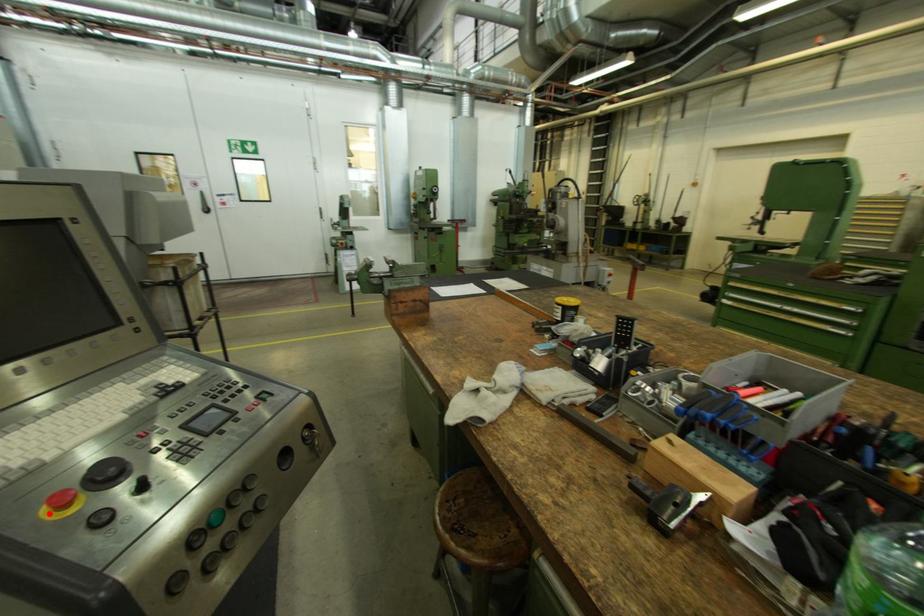
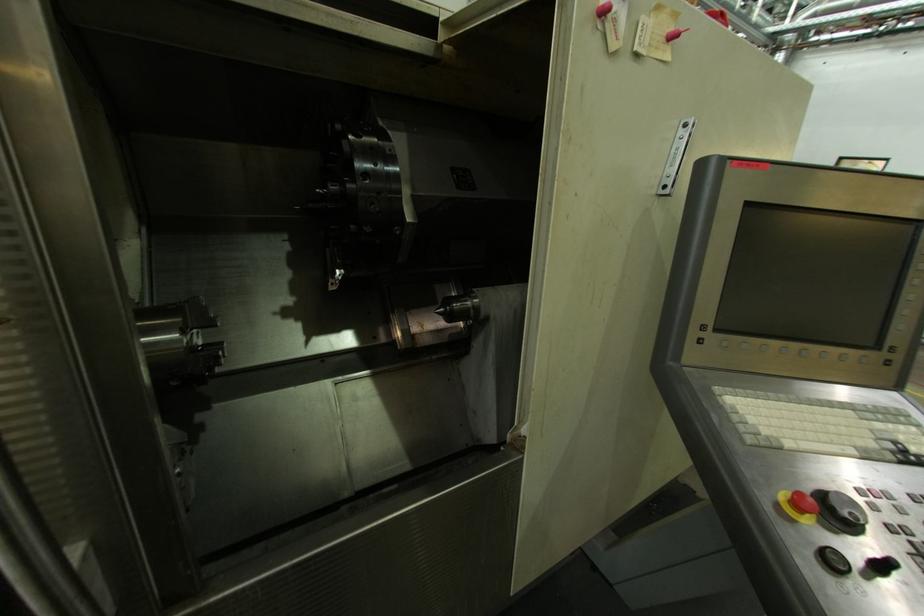
The point at the highlighted location is marked in the first image. Where is the corresponding point in the second image?

(787, 498)